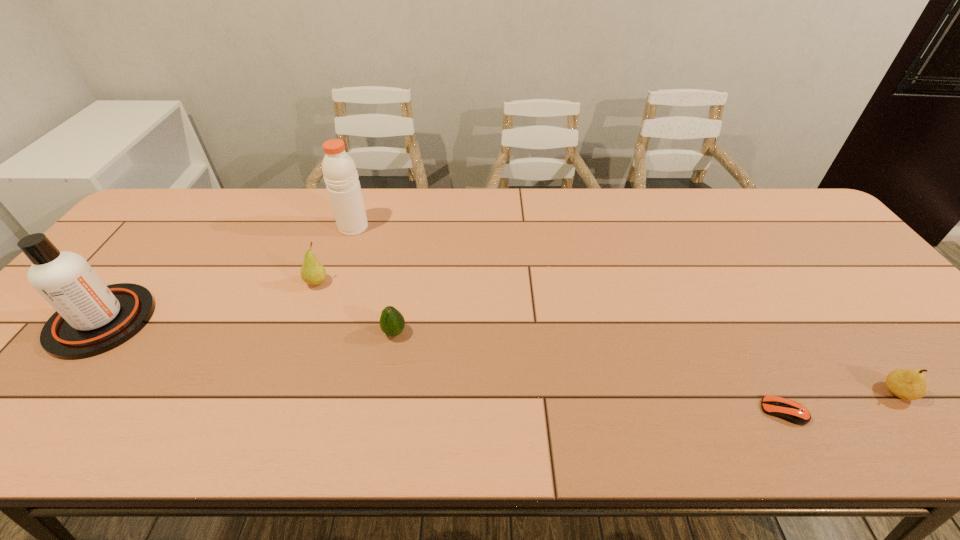
The height and width of the screenshot is (540, 960). In order to click on vacant space that satisfies the following two spatial constraints: 1. on the front side of the second object from right to left; 2. on the right side of the cleansing agent in this screenshot , I will do [x=29, y=411].

This screenshot has width=960, height=540. In order to click on free space that satisfies the following two spatial constraints: 1. on the front side of the rightmost object; 2. on the left side of the avocado in this screenshot , I will do `click(384, 392)`.